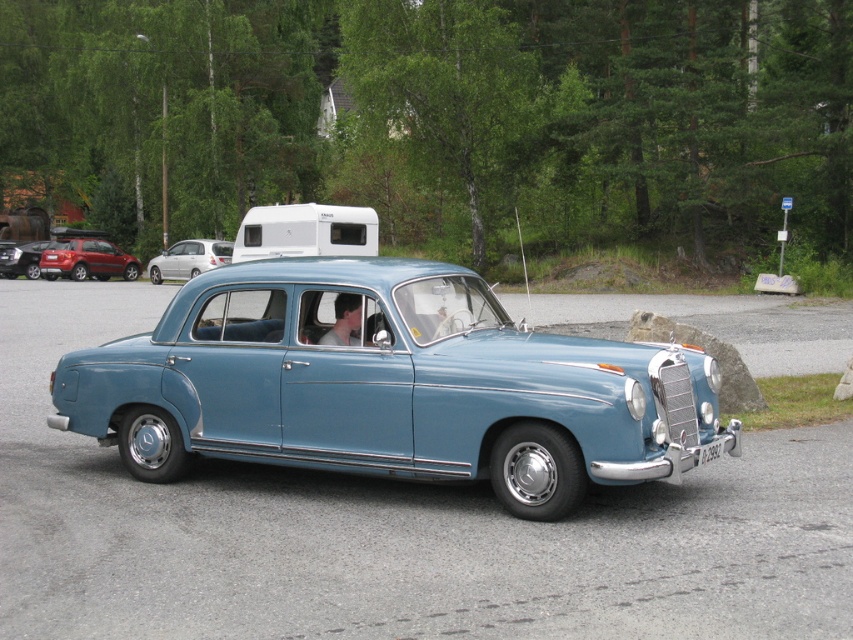
Question: Estimate the real-world distances between objects in this image. Which object is farther from the white plastic recreational vehicle at upper center?

Choices:
 (A) metallic red suv at left
 (B) light blue metallic car at center
 (C) black plastic license plate at center
 (D) smooth skin face at center

Answer: (A)

Question: Does white plastic recreational vehicle at upper center appear over silver metallic hatchback at left?

Choices:
 (A) no
 (B) yes

Answer: (B)

Question: Is white plastic recreational vehicle at upper center positioned before metallic red suv at left?

Choices:
 (A) no
 (B) yes

Answer: (B)

Question: Is white plastic recreational vehicle at upper center thinner than matte black car at lower left?

Choices:
 (A) yes
 (B) no

Answer: (B)

Question: Considering the real-world distances, which object is closest to the matte black car at lower left?

Choices:
 (A) black plastic license plate at center
 (B) smooth skin face at center
 (C) metallic red suv at left

Answer: (C)

Question: Which object is farther from the camera taking this photo?

Choices:
 (A) smooth skin face at center
 (B) light blue metallic car at center

Answer: (A)